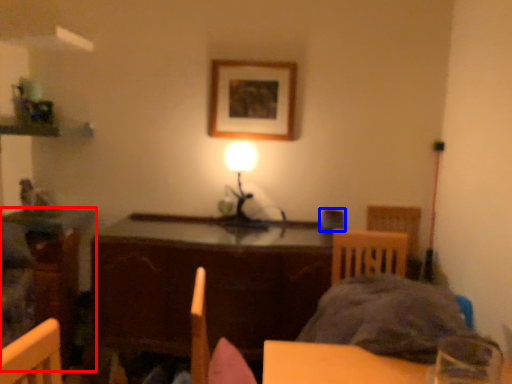
Question: Which point is closer to the camera, table (highlighted by a red box) or armchair (highlighted by a blue box)?

Choices:
 (A) table
 (B) armchair

Answer: (B)